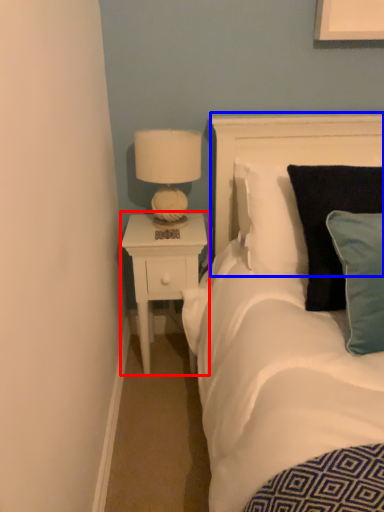
Question: Among these objects, which one is farthest to the camera, nightstand (highlighted by a red box) or headboard (highlighted by a blue box)?

Choices:
 (A) nightstand
 (B) headboard

Answer: (A)